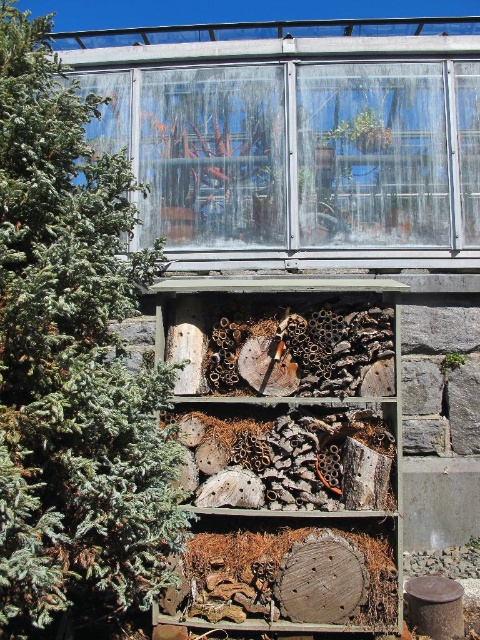
Question: Does green textured pine tree at left have a greater width compared to wooden beehive at center?

Choices:
 (A) no
 (B) yes

Answer: (A)

Question: Considering the relative positions of green textured pine tree at left and wooden beehive at center in the image provided, where is green textured pine tree at left located with respect to wooden beehive at center?

Choices:
 (A) left
 (B) right

Answer: (A)

Question: Which object appears closest to the camera in this image?

Choices:
 (A) green textured pine tree at left
 (B) wooden beehive at center

Answer: (A)

Question: In this image, where is green textured pine tree at left located relative to wooden beehive at center?

Choices:
 (A) below
 (B) above

Answer: (B)